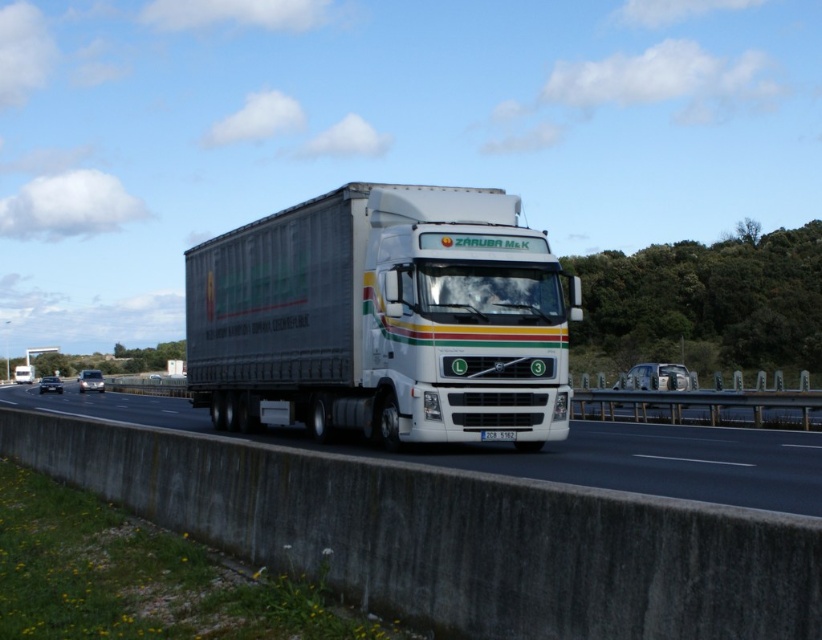
Question: Does white matte trailer truck at center have a greater width compared to white concrete barrier at lower center?

Choices:
 (A) yes
 (B) no

Answer: (B)

Question: Where is white matte trailer truck at center located in relation to white concrete barrier at lower center in the image?

Choices:
 (A) left
 (B) right

Answer: (B)

Question: Observing the image, what is the correct spatial positioning of white matte trailer truck at center in reference to white concrete barrier at lower center?

Choices:
 (A) right
 (B) left

Answer: (A)

Question: Which point appears farthest from the camera in this image?

Choices:
 (A) (818, 506)
 (B) (557, 330)

Answer: (B)